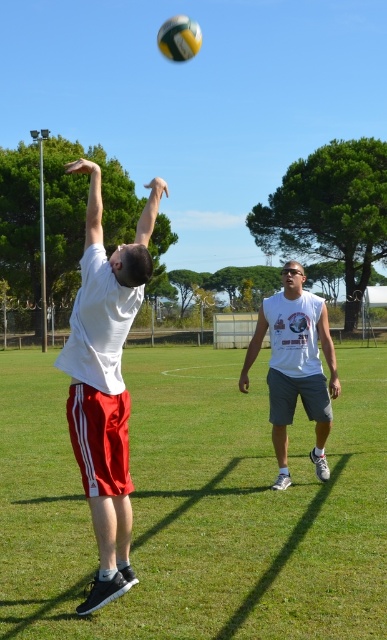
Who is more forward, (138, 348) or (159, 40)?

Point (159, 40) is in front.

Between white fabric shorts at center and yellow matte volleyball at upper center, which one appears on the left side from the viewer's perspective?

Positioned to the left is yellow matte volleyball at upper center.

Does point (282, 499) lie behind point (198, 33)?

No, it is not.

At what (x,y) coordinates should I click in order to perform the action: click on white fabric shorts at center. Please return your answer as a coordinate pair (x, y). The height and width of the screenshot is (640, 387). Looking at the image, I should click on [198, 506].

Between white matte shirt at left and yellow matte volleyball at upper center, which one appears on the left side from the viewer's perspective?

Positioned to the left is white matte shirt at left.

Does white matte shirt at left appear under yellow matte volleyball at upper center?

Correct, white matte shirt at left is located below yellow matte volleyball at upper center.

This screenshot has height=640, width=387. What are the coordinates of `white matte shirt at left` in the screenshot? It's located at (106, 381).

Identify the location of white sleeveless shirt at center. The width and height of the screenshot is (387, 640). (294, 365).

Who is more forward, (323,321) or (186,54)?

Point (323,321) is in front.

Is point (289, 419) positioned in front of point (191, 35)?

Yes, point (289, 419) is in front of point (191, 35).

Where is `white sleeveless shirt at center`? This screenshot has width=387, height=640. white sleeveless shirt at center is located at coordinates [x=294, y=365].